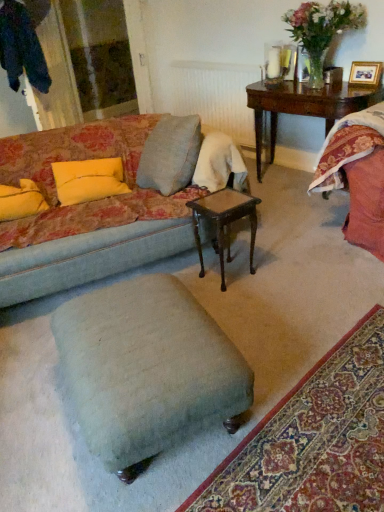
What do you see at coordinates (304, 106) in the screenshot? This screenshot has height=512, width=384. I see `dark wood side table at upper right` at bounding box center [304, 106].

Where is `dark wood side table at upper right`? dark wood side table at upper right is located at coordinates (304, 106).

Measure the distance between wooden stained table at center and camera.

2.07 meters.

You are a GUI agent. You are given a task and a screenshot of the screen. Output one action in this format:
    pyautogui.click(x=<x>, y=<y>)
    Task: Click on the wooden stained table at center
    
    Given the screenshot: What is the action you would take?
    pyautogui.click(x=224, y=222)

Identify the location of velvet floral couch at center. (86, 213).

Where is `yellow fabric pillow at left, which is counted as the first pillow, starting from the right`? The width and height of the screenshot is (384, 512). yellow fabric pillow at left, which is counted as the first pillow, starting from the right is located at coordinates coord(88,180).

Is white textured radiator at upper center at the right side of velvet teal ottoman at lower center?

Incorrect, white textured radiator at upper center is not on the right side of velvet teal ottoman at lower center.

Is white textured radiator at upper center placed right next to velvet teal ottoman at lower center?

No, white textured radiator at upper center is not beside velvet teal ottoman at lower center.

Can you confirm if white textured radiator at upper center is bigger than velvet teal ottoman at lower center?

Indeed, white textured radiator at upper center has a larger size compared to velvet teal ottoman at lower center.

From the image's perspective, is white textured radiator at upper center below velvet teal ottoman at lower center?

Actually, white textured radiator at upper center appears above velvet teal ottoman at lower center in the image.

Considering the sizes of yellow fabric pillow at left, which is the first pillow in left-to-right order, and wooden stained table at center in the image, is yellow fabric pillow at left, which is the first pillow in left-to-right order, taller or shorter than wooden stained table at center?

Considering their sizes, yellow fabric pillow at left, which is the first pillow in left-to-right order, has less height than wooden stained table at center.

Between yellow fabric pillow at left, placed as the 2th pillow when sorted from right to left, and wooden stained table at center, which one appears on the left side from the viewer's perspective?

yellow fabric pillow at left, placed as the 2th pillow when sorted from right to left, is more to the left.

Is yellow fabric pillow at left, which is the first pillow in left-to-right order, oriented towards wooden stained table at center?

No, yellow fabric pillow at left, which is the first pillow in left-to-right order, is not turned towards wooden stained table at center.

Image resolution: width=384 pixels, height=512 pixels. Find the location of `coffee table in front of the yellow fabric pillow at left, which is the first pillow in left-to-right order`. coffee table in front of the yellow fabric pillow at left, which is the first pillow in left-to-right order is located at coordinates (224, 222).

Looking at their sizes, would you say wooden stained table at center is wider or thinner than velvet teal ottoman at lower center?

wooden stained table at center is thinner than velvet teal ottoman at lower center.

Considering the relative positions of wooden stained table at center and velvet teal ottoman at lower center in the image provided, is wooden stained table at center to the right of velvet teal ottoman at lower center from the viewer's perspective?

No.

From the image's perspective, is wooden stained table at center beneath velvet teal ottoman at lower center?

No, from the image's perspective, wooden stained table at center is not beneath velvet teal ottoman at lower center.

From a real-world perspective, which is physically above, wooden stained table at center or velvet teal ottoman at lower center?

wooden stained table at center, from a real-world perspective.

Considering the sizes of objects velvet floral couch at center and white textured radiator at upper center in the image provided, who is thinner, velvet floral couch at center or white textured radiator at upper center?

With smaller width is white textured radiator at upper center.

From a real-world perspective, which object rests below the other?

In real-world perspective, velvet floral couch at center is lower.

There is a velvet floral couch at center. Find the location of `radiator above it (from a real-world perspective)`. radiator above it (from a real-world perspective) is located at coordinates (216, 96).

Who is taller, velvet floral couch at center or white textured radiator at upper center?

velvet floral couch at center is taller.

In the scene shown: From a real-world perspective, who is located higher, yellow fabric pillow at left, which is counted as the first pillow, starting from the right, or velvet floral couch at center?

yellow fabric pillow at left, which is counted as the first pillow, starting from the right, from a real-world perspective.

Is velvet floral couch at center at the back of yellow fabric pillow at left, arranged as the 2th pillow when viewed from the left?

Yes, velvet floral couch at center is at the back of yellow fabric pillow at left, arranged as the 2th pillow when viewed from the left.

Is yellow fabric pillow at left, arranged as the 2th pillow when viewed from the left, to the left of velvet floral couch at center from the viewer's perspective?

Indeed, yellow fabric pillow at left, arranged as the 2th pillow when viewed from the left, is positioned on the left side of velvet floral couch at center.

In terms of width, does yellow fabric pillow at left, which is counted as the first pillow, starting from the right, look wider or thinner when compared to velvet floral couch at center?

yellow fabric pillow at left, which is counted as the first pillow, starting from the right, is thinner than velvet floral couch at center.

Is dark wood side table at upper right oriented away from yellow fabric pillow at left, arranged as the 2th pillow when viewed from the left?

No, dark wood side table at upper right is not facing the opposite direction of yellow fabric pillow at left, arranged as the 2th pillow when viewed from the left.

From the image's perspective, is dark wood side table at upper right located beneath yellow fabric pillow at left, which is counted as the first pillow, starting from the right?

Incorrect, from the image's perspective, dark wood side table at upper right is higher than yellow fabric pillow at left, which is counted as the first pillow, starting from the right.

Relative to yellow fabric pillow at left, arranged as the 2th pillow when viewed from the left, is dark wood side table at upper right in front or behind?

In the image, dark wood side table at upper right appears behind yellow fabric pillow at left, arranged as the 2th pillow when viewed from the left.

Does dark wood side table at upper right have a lesser width compared to yellow fabric pillow at left, arranged as the 2th pillow when viewed from the left?

Result: No.

From a real-world perspective, is yellow fabric pillow at left, placed as the 2th pillow when sorted from right to left, physically below dark wood side table at upper right?

Incorrect, from a real-world perspective, yellow fabric pillow at left, placed as the 2th pillow when sorted from right to left, is higher than dark wood side table at upper right.

Is yellow fabric pillow at left, placed as the 2th pillow when sorted from right to left, taller than dark wood side table at upper right?

In fact, yellow fabric pillow at left, placed as the 2th pillow when sorted from right to left, may be shorter than dark wood side table at upper right.

Looking at this image, from the image's perspective, who appears lower, yellow fabric pillow at left, which is the first pillow in left-to-right order, or dark wood side table at upper right?

yellow fabric pillow at left, which is the first pillow in left-to-right order, appears lower in the image.

Is yellow fabric pillow at left, placed as the 2th pillow when sorted from right to left, turned away from dark wood side table at upper right?

yellow fabric pillow at left, placed as the 2th pillow when sorted from right to left, does not have its back to dark wood side table at upper right.

The width and height of the screenshot is (384, 512). Find the location of `mat beneath the white textured radiator at upper center (from a real-world perspective)`. mat beneath the white textured radiator at upper center (from a real-world perspective) is located at coordinates [313, 439].

In the image, there is a yellow fabric pillow at left, placed as the 2th pillow when sorted from right to left. Identify the location of coffee table below it (from the image's perspective). (224, 222).

Which object lies nearer to the anchor point yellow fabric pillow at left, which is the first pillow in left-to-right order, yellow fabric pillow at left, arranged as the 2th pillow when viewed from the left, or wooden picture frame at upper right?

yellow fabric pillow at left, arranged as the 2th pillow when viewed from the left.

Estimate the real-world distances between objects in this image. Which object is closer to light blue fabric stool at center, velvet floral couch at center or yellow fabric pillow at left, which is the first pillow in left-to-right order?

Based on the image, velvet floral couch at center appears to be nearer to light blue fabric stool at center.

Estimate the real-world distances between objects in this image. Which object is further from dark wood side table at upper right, light blue fabric stool at center or velvet floral couch at center?

The object further to dark wood side table at upper right is light blue fabric stool at center.

Estimate the real-world distances between objects in this image. Which object is further from white textured radiator at upper center, velvet floral couch at center or wooden picture frame at upper right?

velvet floral couch at center.

Estimate the real-world distances between objects in this image. Which object is closer to velvet floral couch at center, velvet teal ottoman at lower center or white textured radiator at upper center?

Among the two, velvet teal ottoman at lower center is located nearer to velvet floral couch at center.

When comparing their distances from velvet floral couch at center, does dark wood side table at upper right or wooden stained table at center seem closer?

Based on the image, wooden stained table at center appears to be nearer to velvet floral couch at center.

Considering their positions, is wooden picture frame at upper right positioned closer to light blue fabric stool at center than velvet teal ottoman at lower center?

Among the two, velvet teal ottoman at lower center is located nearer to light blue fabric stool at center.

Looking at the image, which one is located further to dark wood side table at upper right, wooden stained table at center or yellow fabric pillow at left, placed as the 2th pillow when sorted from right to left?

Based on the image, yellow fabric pillow at left, placed as the 2th pillow when sorted from right to left, appears to be further to dark wood side table at upper right.

You are a GUI agent. You are given a task and a screenshot of the screen. Output one action in this format:
    pyautogui.click(x=<x>, y=<y>)
    Task: Click on the pillow located between velvet floral couch at center and yellow fabric pillow at left, arranged as the 2th pillow when viewed from the left, in the depth direction
    Image resolution: width=384 pixels, height=512 pixels.
    Given the screenshot: What is the action you would take?
    pyautogui.click(x=21, y=200)

Where is `studio couch located between yellow fabric pillow at left, placed as the 2th pillow when sorted from right to left, and wooden stained table at center in the left-right direction`? This screenshot has width=384, height=512. studio couch located between yellow fabric pillow at left, placed as the 2th pillow when sorted from right to left, and wooden stained table at center in the left-right direction is located at coordinates (86, 213).

Where is `mat situated between yellow fabric pillow at left, placed as the 2th pillow when sorted from right to left, and wooden picture frame at upper right from left to right`? The height and width of the screenshot is (512, 384). mat situated between yellow fabric pillow at left, placed as the 2th pillow when sorted from right to left, and wooden picture frame at upper right from left to right is located at coordinates (313, 439).

This screenshot has height=512, width=384. In order to click on stool between velvet teal ottoman at lower center and wooden stained table at center from front to back in this screenshot , I will do `click(147, 368)`.